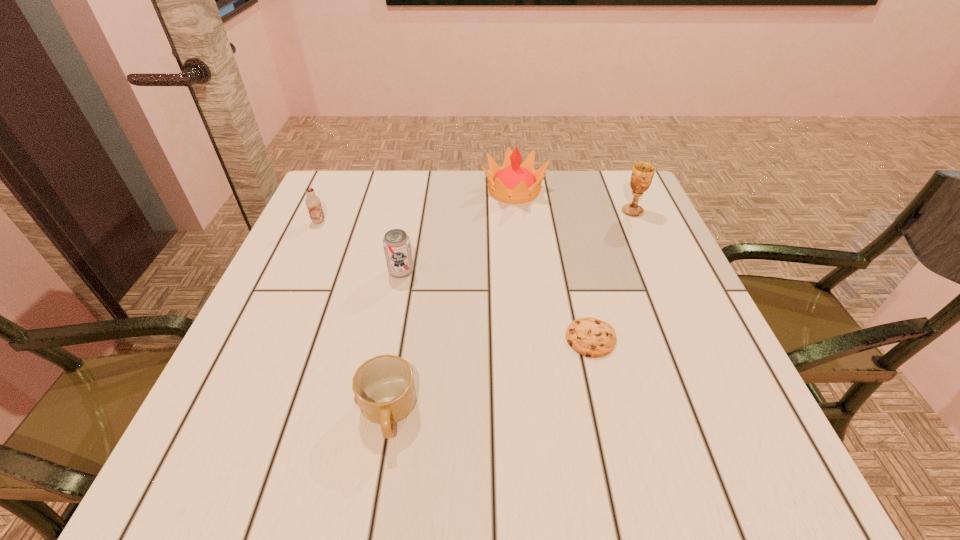
Locate an element on the screen. This screenshot has height=540, width=960. crown is located at coordinates (512, 183).

Where is `the rightmost object`? The image size is (960, 540). the rightmost object is located at coordinates (642, 174).

Find the location of a particular element. The height and width of the screenshot is (540, 960). the third nearest object is located at coordinates (396, 243).

Where is `chocolate milk`? chocolate milk is located at coordinates (313, 203).

In order to click on the leftmost object in this screenshot , I will do `click(313, 203)`.

The width and height of the screenshot is (960, 540). What are the coordinates of `the nearest object` in the screenshot? It's located at (384, 388).

The height and width of the screenshot is (540, 960). In order to click on mug in this screenshot , I will do pos(384,388).

The width and height of the screenshot is (960, 540). I want to click on cookie, so click(x=590, y=337).

Locate an element on the screen. the shortest object is located at coordinates (590, 337).

Where is `vacant area situated 0.260m on the left of the crown`? The width and height of the screenshot is (960, 540). vacant area situated 0.260m on the left of the crown is located at coordinates (387, 190).